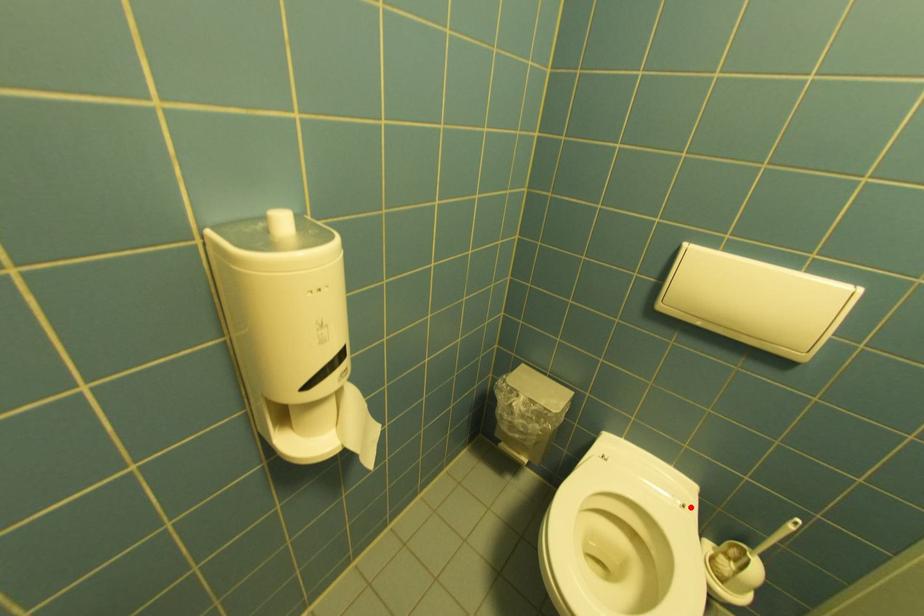
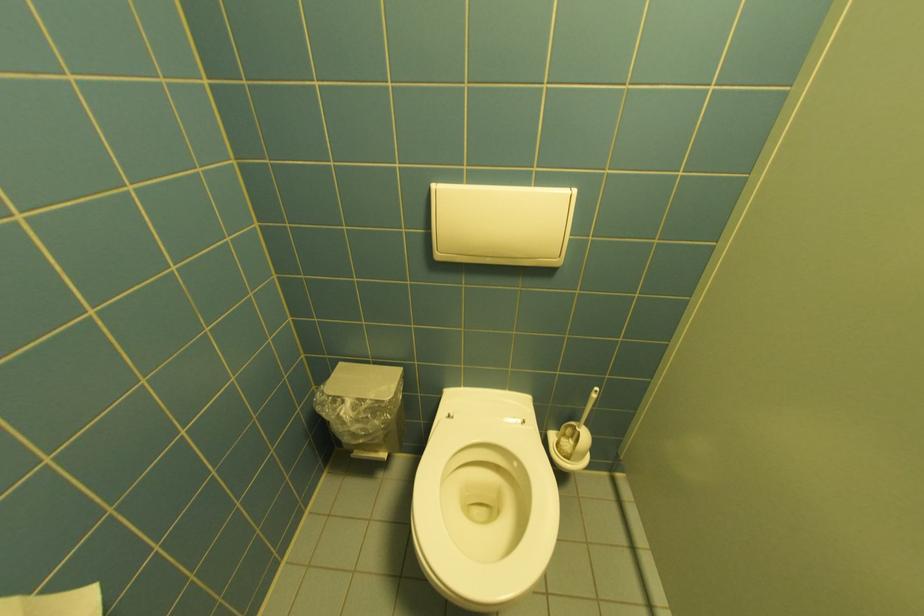
In the second image, find the point that corresponds to the highlighted location in the first image.

(529, 424)